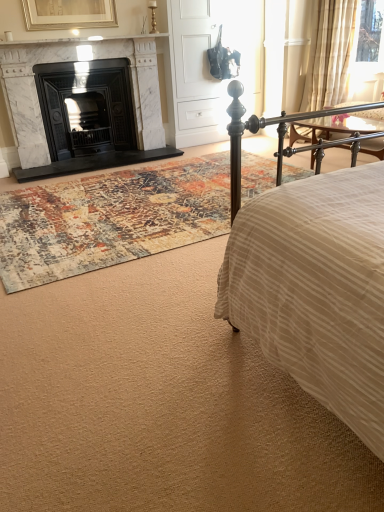
Question: Would you say white matte armoire at center is inside or outside sheer beige fabric at upper right?

Choices:
 (A) outside
 (B) inside

Answer: (A)

Question: From a real-world perspective, is white matte armoire at center physically located above or below sheer beige fabric at upper right?

Choices:
 (A) above
 (B) below

Answer: (A)

Question: Based on their relative distances, which object is farther from the sheer beige fabric at upper right?

Choices:
 (A) multicolored rug at center
 (B) white marble fireplace at left, which ranks as the 1th fireplace in right-to-left order
 (C) white matte armoire at center
 (D) gold metallic table lamp at upper center
 (E) black marble fireplace at left, the 2th fireplace when ordered from right to left

Answer: (A)

Question: Which object is positioned closest to the black marble fireplace at left, the 2th fireplace when ordered from right to left?

Choices:
 (A) white marble fireplace at left, positioned as the second fireplace in left-to-right order
 (B) gold metallic table lamp at upper center
 (C) multicolored rug at center
 (D) white matte armoire at center
 (E) sheer beige fabric at upper right

Answer: (A)